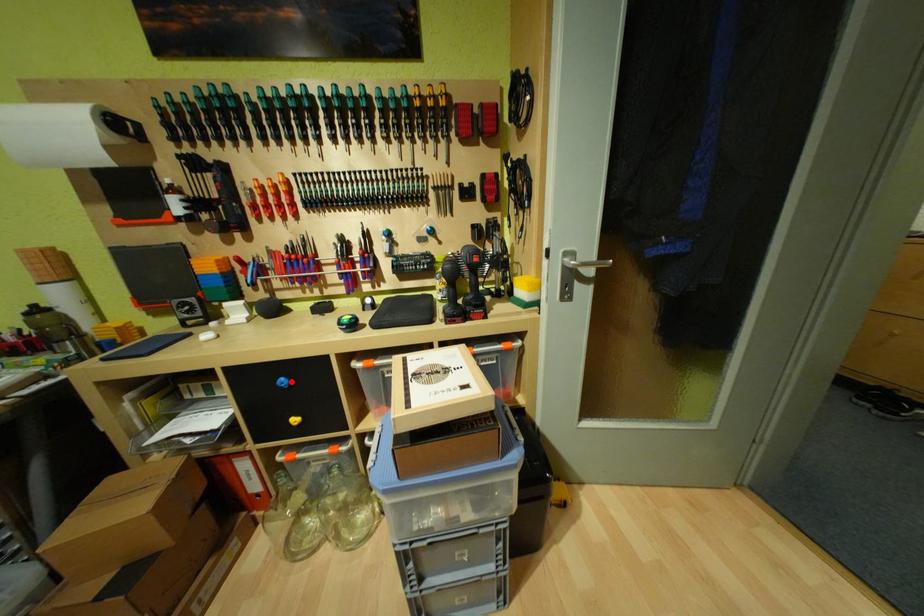
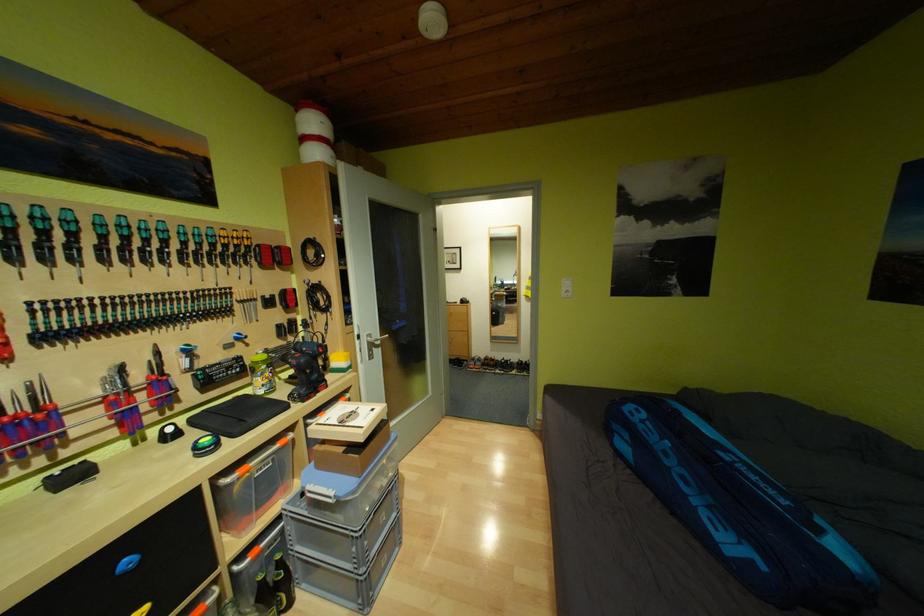
Locate, in the second image, the point that corresponds to the highlighted location in the first image.

(136, 562)